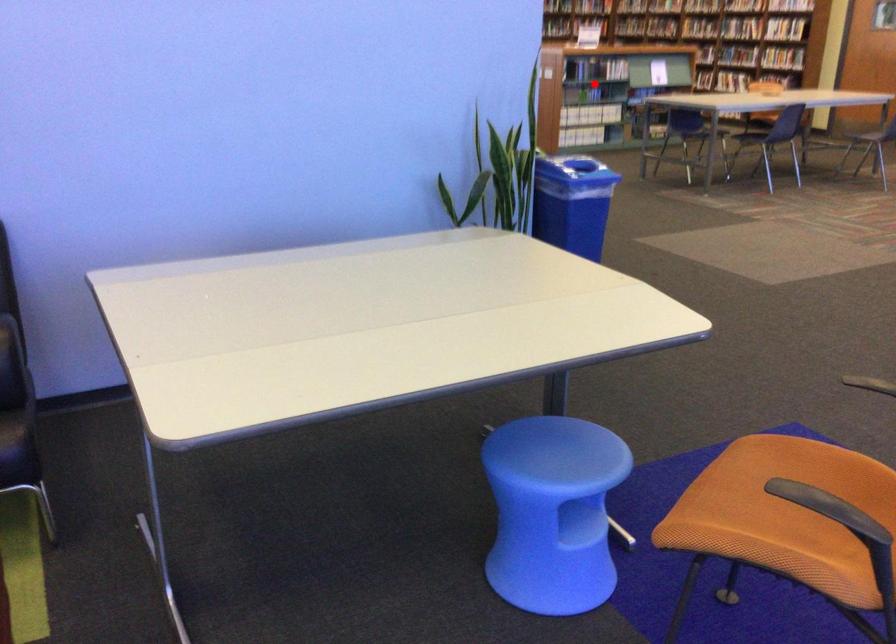
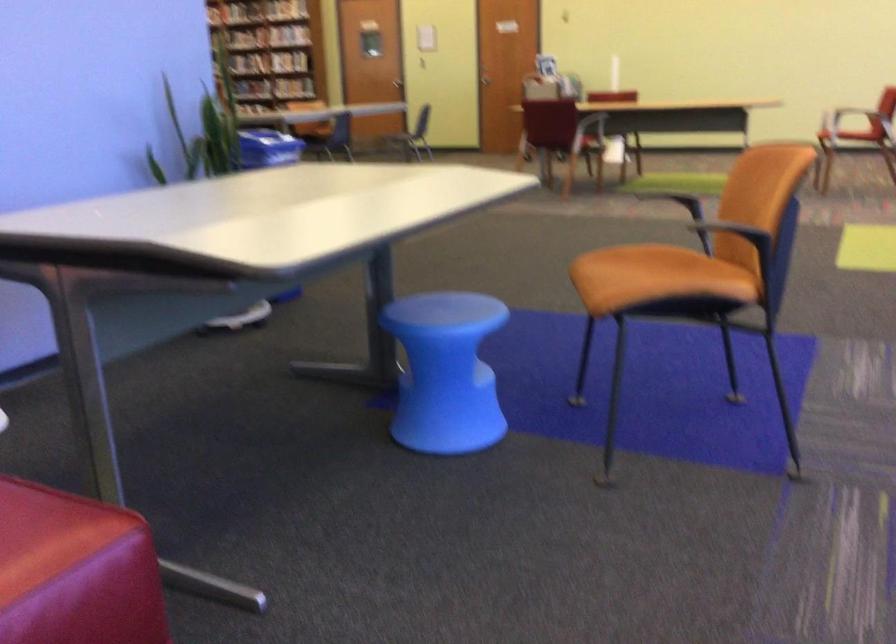
Question: I am providing you with two images of the same scene from different viewpoints. A red point is marked on the first image. Can you still see the location of the red point in image 2?

Choices:
 (A) Yes
 (B) No

Answer: (B)